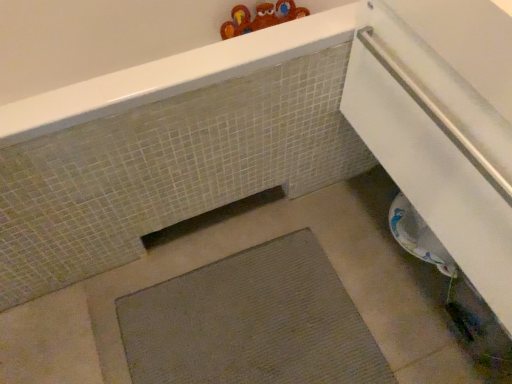
Question: From the image's perspective, is white glossy towel at lower right located beneath gray textured bath mat at center?

Choices:
 (A) yes
 (B) no

Answer: (B)

Question: Does white glossy towel at lower right have a smaller size compared to gray textured bath mat at center?

Choices:
 (A) no
 (B) yes

Answer: (A)

Question: Are white glossy towel at lower right and gray textured bath mat at center making contact?

Choices:
 (A) no
 (B) yes

Answer: (A)

Question: Is white glossy towel at lower right outside of gray textured bath mat at center?

Choices:
 (A) no
 (B) yes

Answer: (B)

Question: Does white glossy towel at lower right turn towards gray textured bath mat at center?

Choices:
 (A) no
 (B) yes

Answer: (A)

Question: Is white glossy towel at lower right wider than gray textured bath mat at center?

Choices:
 (A) no
 (B) yes

Answer: (A)

Question: From the image's perspective, is matte gray mat at lower center on gray textured bath mat at center?

Choices:
 (A) yes
 (B) no

Answer: (A)

Question: Considering the relative sizes of matte gray mat at lower center and gray textured bath mat at center in the image provided, is matte gray mat at lower center bigger than gray textured bath mat at center?

Choices:
 (A) no
 (B) yes

Answer: (B)

Question: Is matte gray mat at lower center further to the viewer compared to gray textured bath mat at center?

Choices:
 (A) yes
 (B) no

Answer: (B)

Question: From a real-world perspective, does matte gray mat at lower center sit lower than gray textured bath mat at center?

Choices:
 (A) no
 (B) yes

Answer: (A)

Question: Is matte gray mat at lower center to the left of gray textured bath mat at center from the viewer's perspective?

Choices:
 (A) no
 (B) yes

Answer: (B)

Question: Is matte gray mat at lower center closer to the viewer compared to gray textured bath mat at center?

Choices:
 (A) no
 (B) yes

Answer: (B)

Question: Would you say matte gray mat at lower center is outside white glossy towel at lower right?

Choices:
 (A) no
 (B) yes

Answer: (B)